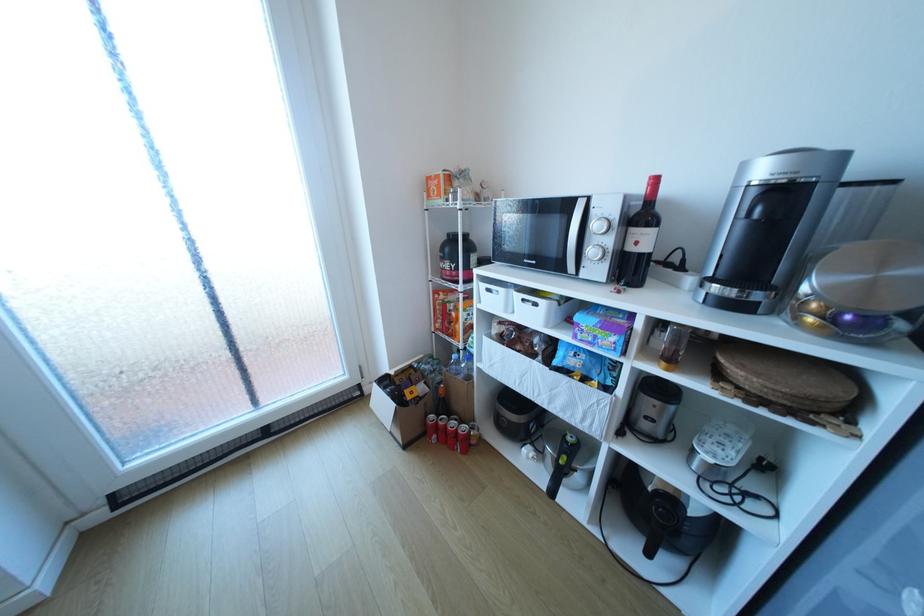
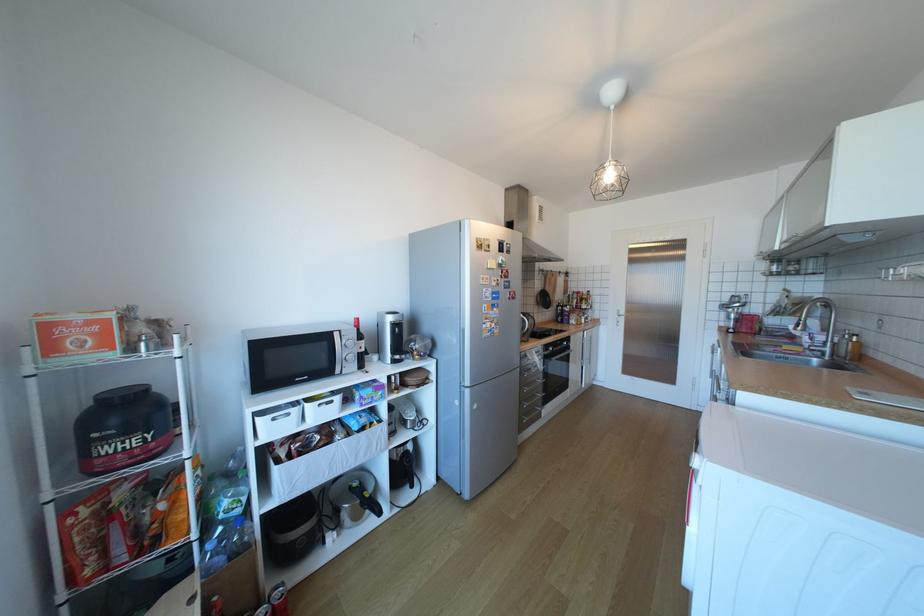
Find the pixel in the second image that matches [444,193] in the first image.

(91, 346)